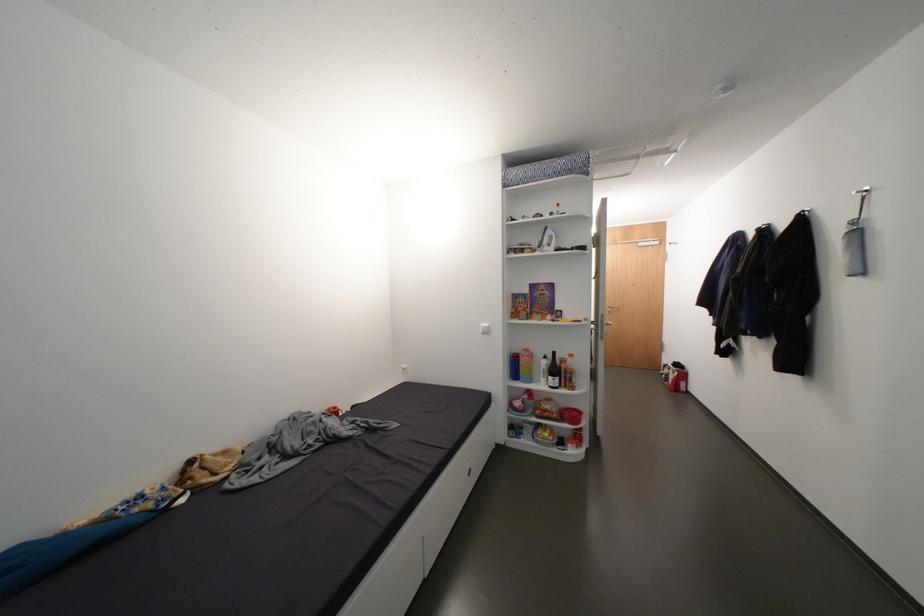
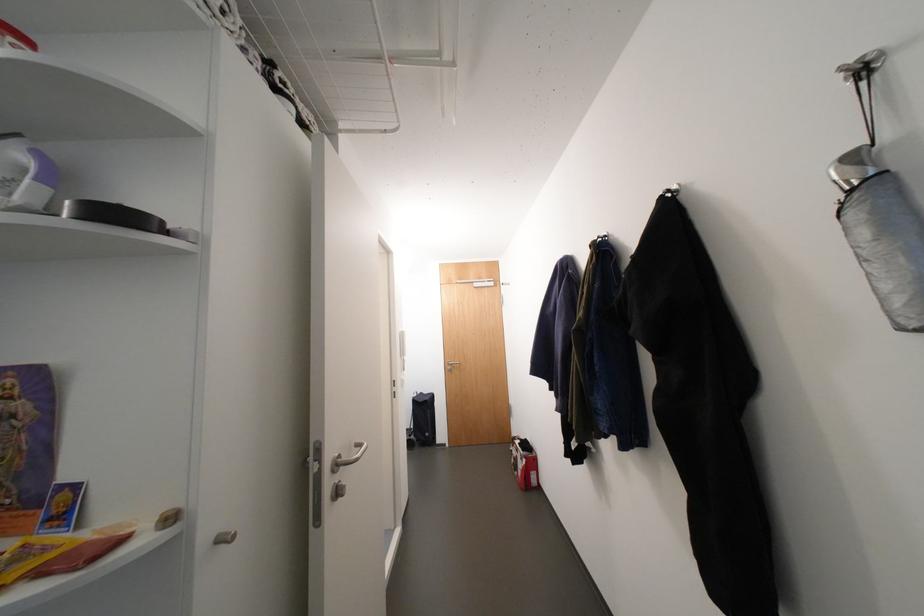
Find the pixel in the second image that matches point (677, 382) in the first image.

(527, 474)